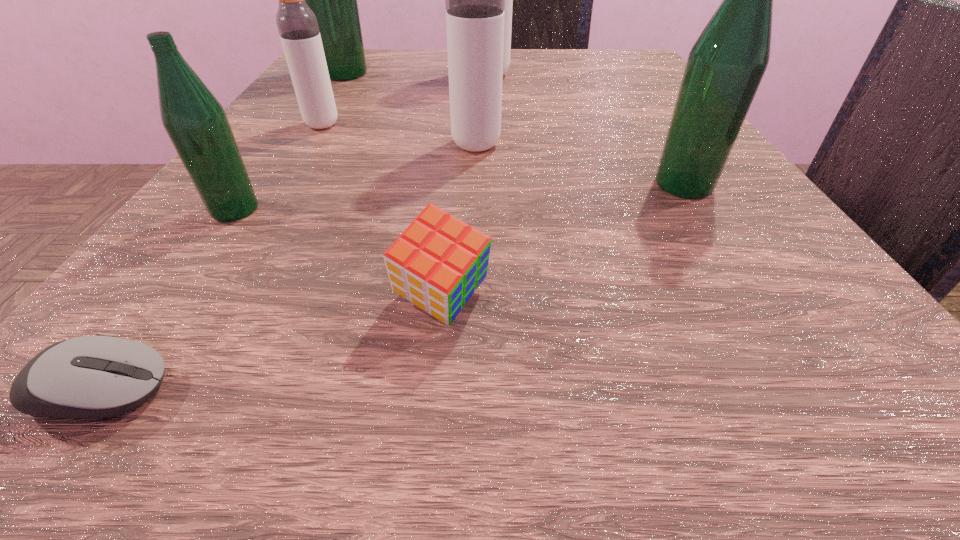
I want to click on vacant space in between the third farthest object and the smallest green bottle, so click(x=278, y=167).

Locate an element on the screen. This screenshot has height=540, width=960. blank region between the farthest green bottle and the smallest green bottle is located at coordinates (290, 141).

At what (x,y) coordinates should I click in order to perform the action: click on vacant area that lies between the farthest gray bottle and the smallest green bottle. Please return your answer as a coordinate pair (x, y). The width and height of the screenshot is (960, 540). Looking at the image, I should click on (361, 143).

The image size is (960, 540). Find the location of `object that stands as the sixth closest to the rightmost bottle`. object that stands as the sixth closest to the rightmost bottle is located at coordinates (100, 376).

Image resolution: width=960 pixels, height=540 pixels. I want to click on object that is the sixth closest to the nearest gray bottle, so click(x=333, y=0).

Where is `the third closest bottle to the smallest gray bottle`? the third closest bottle to the smallest gray bottle is located at coordinates pyautogui.click(x=474, y=0).

Where is `the second closest bottle to the smallest green bottle`? The width and height of the screenshot is (960, 540). the second closest bottle to the smallest green bottle is located at coordinates (474, 0).

You are a GUI agent. You are given a task and a screenshot of the screen. Output one action in this format:
    pyautogui.click(x=<x>, y=<y>)
    Task: Click on the green bottle that is the third closest to the farthest gray bottle
    
    Given the screenshot: What is the action you would take?
    pyautogui.click(x=195, y=121)

Image resolution: width=960 pixels, height=540 pixels. Find the location of `green bottle that is the closest to the nearest gray bottle`. green bottle that is the closest to the nearest gray bottle is located at coordinates (725, 66).

Find the location of `gray bottle that is the second nearest to the smallest gray bottle`. gray bottle that is the second nearest to the smallest gray bottle is located at coordinates (508, 0).